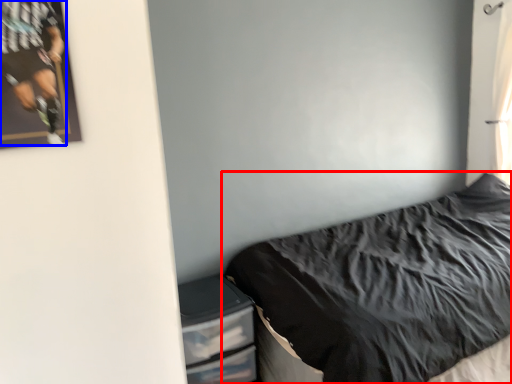
Question: Which object is closer to the camera taking this photo, bed (highlighted by a red box) or person (highlighted by a blue box)?

Choices:
 (A) bed
 (B) person

Answer: (B)